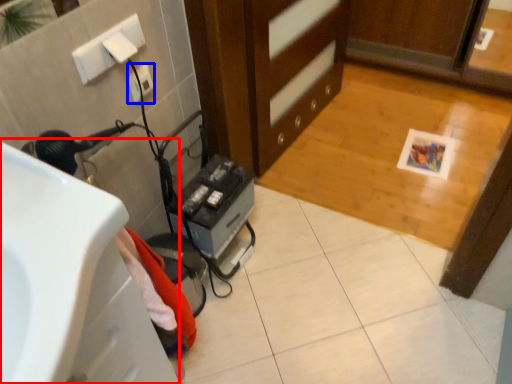
Question: Which object appears farthest to the camera in this image, sink (highlighted by a red box) or electric outlet (highlighted by a blue box)?

Choices:
 (A) sink
 (B) electric outlet

Answer: (B)